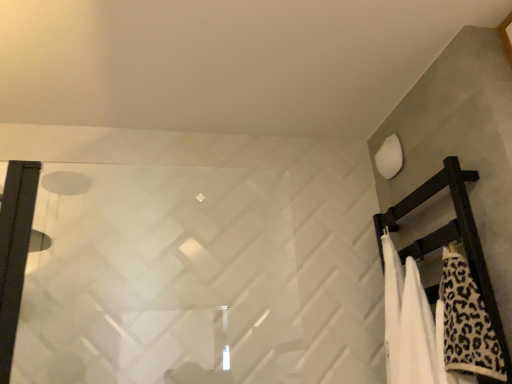
In order to face white leopard print towel at right, should I rotate leftwards or rightwards?

Rotate your view right by about 24.955°.

I want to click on white leopard print towel at right, so click(467, 323).

The width and height of the screenshot is (512, 384). Describe the element at coordinates (467, 323) in the screenshot. I see `white leopard print towel at right` at that location.

Image resolution: width=512 pixels, height=384 pixels. I want to click on white leopard print towel at right, so click(467, 323).